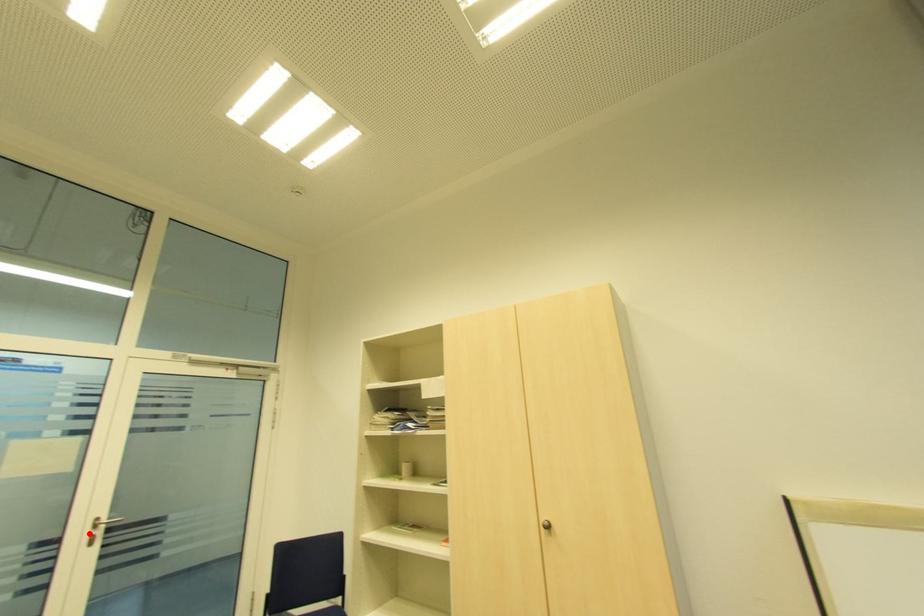
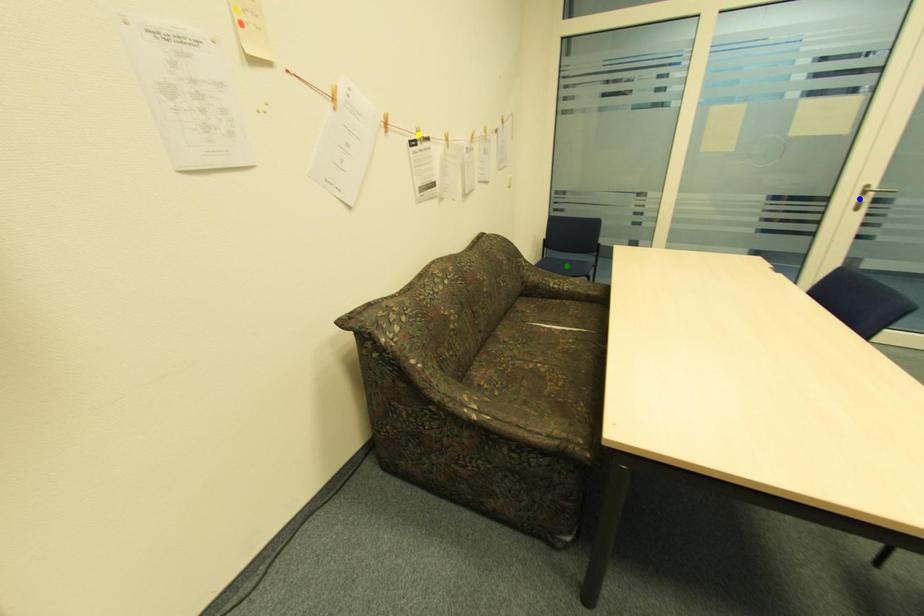
Question: I am providing you with two images of the same scene from different viewpoints. A red point is marked on the first image. You are given multiple points on the second image. Which mark in image 2 goes with the point in image 1?

Choices:
 (A) green point
 (B) blue point
 (C) yellow point

Answer: (B)